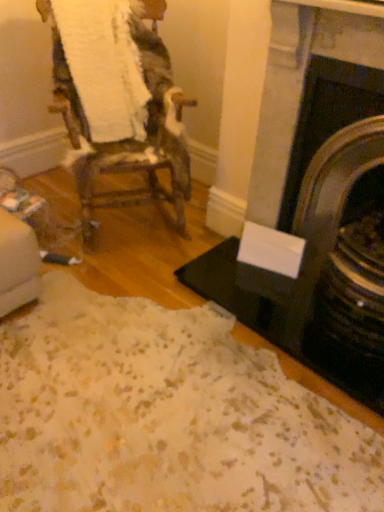
Question: From a real-world perspective, relative to woodenchair at left, is dark gray stone fireplace at right vertically above or below?

Choices:
 (A) below
 (B) above

Answer: (B)

Question: From the image's perspective, is dark gray stone fireplace at right positioned above or below woodenchair at left?

Choices:
 (A) below
 (B) above

Answer: (A)

Question: Is dark gray stone fireplace at right spatially inside woodenchair at left, or outside of it?

Choices:
 (A) inside
 (B) outside

Answer: (B)

Question: In the image, is woodenchair at left on the left side or the right side of dark gray stone fireplace at right?

Choices:
 (A) right
 (B) left

Answer: (B)

Question: From a real-world perspective, is woodenchair at left positioned above or below dark gray stone fireplace at right?

Choices:
 (A) above
 (B) below

Answer: (B)

Question: Would you say woodenchair at left is inside or outside dark gray stone fireplace at right?

Choices:
 (A) outside
 (B) inside

Answer: (A)

Question: From the image's perspective, is woodenchair at left located above or below dark gray stone fireplace at right?

Choices:
 (A) above
 (B) below

Answer: (A)